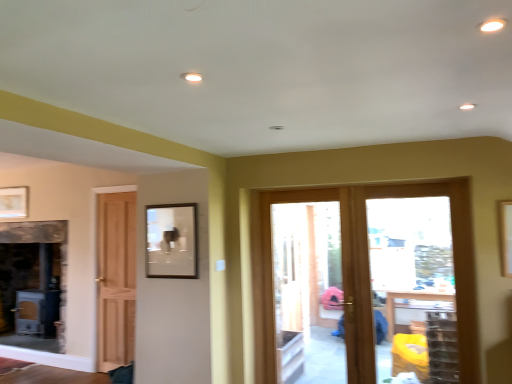
The height and width of the screenshot is (384, 512). What do you see at coordinates (368, 284) in the screenshot?
I see `wooden door at center` at bounding box center [368, 284].

How much space does matte brown picture frame at upper center, which appears as the 2th picture frame when viewed from the left, occupy horizontally?

1.66 inches.

This screenshot has height=384, width=512. I want to click on clear glass door at center, so click(418, 276).

At what (x,y) coordinates should I click in order to perform the action: click on wooden door at center. Please return your answer as a coordinate pair (x, y). This screenshot has height=384, width=512. Looking at the image, I should click on (368, 284).

Considering the relative sizes of wooden door at center and matte gold picture frame at upper left, the second picture frame viewed from the front, in the image provided, is wooden door at center smaller than matte gold picture frame at upper left, the second picture frame viewed from the front,?

Actually, wooden door at center might be larger than matte gold picture frame at upper left, the second picture frame viewed from the front.

From the image's perspective, which one is positioned higher, wooden door at center or matte gold picture frame at upper left, the second picture frame positioned from the right?

matte gold picture frame at upper left, the second picture frame positioned from the right, appears higher in the image.

From a real-world perspective, between wooden door at center and matte gold picture frame at upper left, the second picture frame viewed from the front, who is vertically lower?

wooden door at center, from a real-world perspective.

At what (x,y) coordinates should I click in order to perform the action: click on door below the matte gold picture frame at upper left, the second picture frame positioned from the right (from the image's perspective). Please return your answer as a coordinate pair (x, y). Looking at the image, I should click on (368, 284).

Considering the relative sizes of matte brown picture frame at upper center, which appears as the 2th picture frame when viewed from the left, and wooden door at center in the image provided, is matte brown picture frame at upper center, which appears as the 2th picture frame when viewed from the left, wider than wooden door at center?

No, matte brown picture frame at upper center, which appears as the 2th picture frame when viewed from the left, is not wider than wooden door at center.

From a real-world perspective, is matte brown picture frame at upper center, the second picture frame when ordered from back to front, under wooden door at center?

Incorrect, from a real-world perspective, matte brown picture frame at upper center, the second picture frame when ordered from back to front, is higher than wooden door at center.

Considering the sizes of objects matte brown picture frame at upper center, which appears as the first picture frame when viewed from the front, and wooden door at center in the image provided, who is bigger, matte brown picture frame at upper center, which appears as the first picture frame when viewed from the front, or wooden door at center?

With larger size is wooden door at center.

Is matte brown picture frame at upper center, the second picture frame when ordered from back to front, looking in the opposite direction of wooden door at center?

matte brown picture frame at upper center, the second picture frame when ordered from back to front, is not turned away from wooden door at center.

Considering the relative sizes of clear glass door at center and matte brown picture frame at upper center, which appears as the 2th picture frame when viewed from the left, in the image provided, is clear glass door at center shorter than matte brown picture frame at upper center, which appears as the 2th picture frame when viewed from the left,?

In fact, clear glass door at center may be taller than matte brown picture frame at upper center, which appears as the 2th picture frame when viewed from the left.

Is clear glass door at center positioned behind matte brown picture frame at upper center, which is counted as the 1th picture frame, starting from the right?

Yes, clear glass door at center is further from the camera.

Is clear glass door at center positioned beyond the bounds of matte brown picture frame at upper center, which is counted as the 1th picture frame, starting from the right?

Yes.

Is wooden door at center oriented away from matte brown picture frame at upper center, which appears as the first picture frame when viewed from the front?

wooden door at center does not have its back to matte brown picture frame at upper center, which appears as the first picture frame when viewed from the front.

Which of these two, wooden door at center or matte brown picture frame at upper center, which is counted as the 1th picture frame, starting from the right, is wider?

wooden door at center.

Based on the photo, would you say wooden door at center is outside matte brown picture frame at upper center, which appears as the first picture frame when viewed from the front?

That's correct, wooden door at center is outside of matte brown picture frame at upper center, which appears as the first picture frame when viewed from the front.

Based on their sizes in the image, would you say wooden door at center is bigger or smaller than matte brown picture frame at upper center, which appears as the first picture frame when viewed from the front?

Clearly, wooden door at center is larger in size than matte brown picture frame at upper center, which appears as the first picture frame when viewed from the front.

From the image's perspective, is clear glass door at center below matte brown picture frame at upper center, which is counted as the 1th picture frame, starting from the right?

Yes.

Between point (415, 233) and point (176, 267), which one is positioned behind?

The point (415, 233) is farther from the camera.

How much distance is there between clear glass door at center and matte brown picture frame at upper center, which appears as the 2th picture frame when viewed from the left?

A distance of 6.36 feet exists between clear glass door at center and matte brown picture frame at upper center, which appears as the 2th picture frame when viewed from the left.

Locate an element on the screen. The image size is (512, 384). glass door located on the right of matte brown picture frame at upper center, which is counted as the 1th picture frame, starting from the right is located at coordinates coord(418,276).

This screenshot has height=384, width=512. I want to click on picture frame located above the matte brown picture frame at upper center, which is counted as the 1th picture frame, starting from the right (from a real-world perspective), so click(14, 202).

Would you consider matte gold picture frame at upper left, which is counted as the first picture frame, starting from the back, to be distant from matte brown picture frame at upper center, which appears as the 2th picture frame when viewed from the left?

Yes, matte gold picture frame at upper left, which is counted as the first picture frame, starting from the back, and matte brown picture frame at upper center, which appears as the 2th picture frame when viewed from the left, are quite far apart.

Is matte gold picture frame at upper left, the second picture frame positioned from the right, smaller than matte brown picture frame at upper center, which is counted as the 1th picture frame, starting from the right?

Correct, matte gold picture frame at upper left, the second picture frame positioned from the right, occupies less space than matte brown picture frame at upper center, which is counted as the 1th picture frame, starting from the right.

In the scene shown: Is matte gold picture frame at upper left, marked as the first picture frame in a left-to-right arrangement, in front of or behind matte brown picture frame at upper center, which appears as the 2th picture frame when viewed from the left, in the image?

Clearly, matte gold picture frame at upper left, marked as the first picture frame in a left-to-right arrangement, is behind matte brown picture frame at upper center, which appears as the 2th picture frame when viewed from the left.

Does wooden door at center have a greater height compared to clear glass door at center?

Yes.

Can you tell me how much wooden door at center and clear glass door at center differ in facing direction?

The angle between the facing direction of wooden door at center and the facing direction of clear glass door at center is 0.00673 degrees.

From a real-world perspective, who is located lower, wooden door at center or clear glass door at center?

From a 3D spatial view, clear glass door at center is below.

Which object is positioned more to the right, wooden door at center or clear glass door at center?

From the viewer's perspective, wooden door at center appears more on the right side.

Image resolution: width=512 pixels, height=384 pixels. In order to click on door below the matte gold picture frame at upper left, the second picture frame viewed from the front (from the image's perspective) in this screenshot , I will do `click(368, 284)`.

Identify the location of door in front of the matte brown picture frame at upper center, which is counted as the 1th picture frame, starting from the right. (368, 284).

Based on their spatial positions, is wooden door at center or matte brown picture frame at upper center, which is counted as the 1th picture frame, starting from the right, closer to clear glass door at center?

Based on the image, wooden door at center appears to be nearer to clear glass door at center.

From the image, which object appears to be nearer to clear glass door at center, clear glass door at center or matte gold picture frame at upper left, the second picture frame positioned from the right?

The object closer to clear glass door at center is clear glass door at center.

Considering their positions, is wooden door at center positioned further to matte brown picture frame at upper center, which appears as the first picture frame when viewed from the front, than clear glass door at center?

clear glass door at center.

Looking at the image, which one is located further to matte brown picture frame at upper center, which is counted as the 1th picture frame, starting from the right, matte gold picture frame at upper left, which is counted as the first picture frame, starting from the back, or clear glass door at center?

matte gold picture frame at upper left, which is counted as the first picture frame, starting from the back, is further to matte brown picture frame at upper center, which is counted as the 1th picture frame, starting from the right.

From the image, which object appears to be farther from matte gold picture frame at upper left, which is counted as the first picture frame, starting from the back, clear glass door at center or matte brown picture frame at upper center, which appears as the first picture frame when viewed from the front?

clear glass door at center is positioned further to the anchor matte gold picture frame at upper left, which is counted as the first picture frame, starting from the back.

From the image, which object appears to be nearer to wooden door at center, matte brown picture frame at upper center, which appears as the first picture frame when viewed from the front, or clear glass door at center?

matte brown picture frame at upper center, which appears as the first picture frame when viewed from the front, is positioned closer to the anchor wooden door at center.

Based on the photo, estimate the real-world distances between objects in this image. Which object is further from wooden door at center, matte brown picture frame at upper center, the second picture frame when ordered from back to front, or clear glass door at center?

Based on the image, matte brown picture frame at upper center, the second picture frame when ordered from back to front, appears to be further to wooden door at center.

From the image, which object appears to be farther from clear glass door at center, clear glass door at center or matte gold picture frame at upper left, the second picture frame positioned from the right?

matte gold picture frame at upper left, the second picture frame positioned from the right, is further to clear glass door at center.

Find the location of a particular element. This screenshot has height=384, width=512. picture frame located between matte gold picture frame at upper left, which is counted as the first picture frame, starting from the back, and clear glass door at center in the left-right direction is located at coordinates (170, 241).

Locate an element on the screen. The image size is (512, 384). screen door located between matte brown picture frame at upper center, which appears as the 2th picture frame when viewed from the left, and wooden door at center in the left-right direction is located at coordinates (304, 287).

At what (x,y) coordinates should I click in order to perform the action: click on picture frame between matte gold picture frame at upper left, the second picture frame viewed from the front, and clear glass door at center. Please return your answer as a coordinate pair (x, y). Looking at the image, I should click on (170, 241).

Locate an element on the screen. screen door located between matte gold picture frame at upper left, marked as the first picture frame in a left-to-right arrangement, and clear glass door at center in the left-right direction is located at coordinates (304, 287).